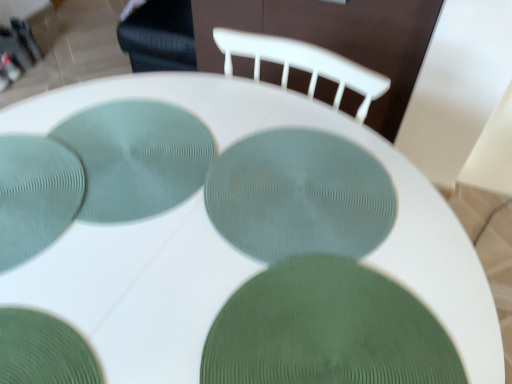
I want to click on free space between matte green plate at center, placed as the second glass plate when sorted from right to left, and matte green plate at lower left, which is the first glass plate in left-to-right order, so click(x=144, y=198).